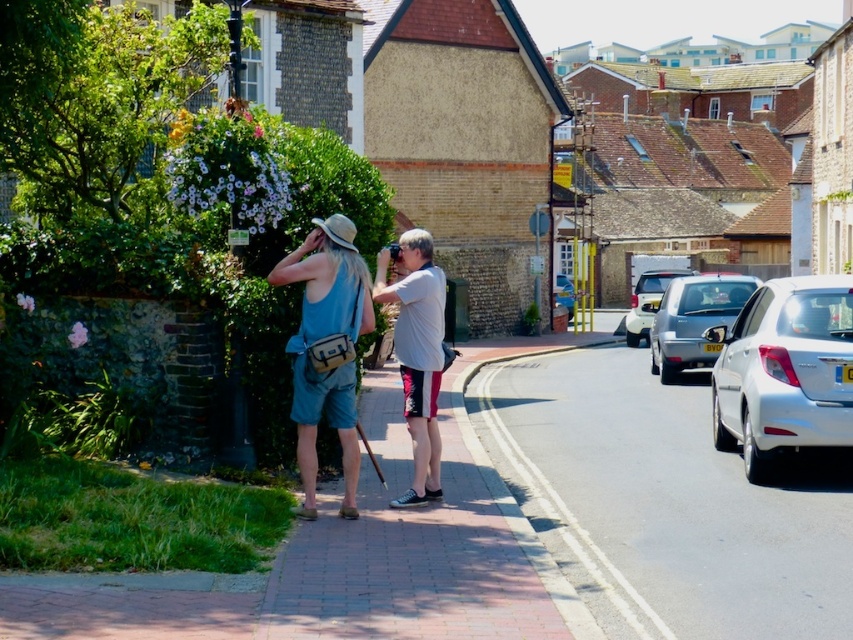
You are a photographer standing at the blue fabric tank top at center position. You want to capture a photo of the white glossy sedan at right. Based on the distance between them, do you think you can fit the entire sedan into your camera frame without moving your position?

The distance between the white glossy sedan at right and the blue fabric tank top at center is 13.16 feet. Since the sedan is 13.16 feet away, it depends on your camera lens. A standard lens might require moving closer, but a wide angle could capture it from that distance without moving.